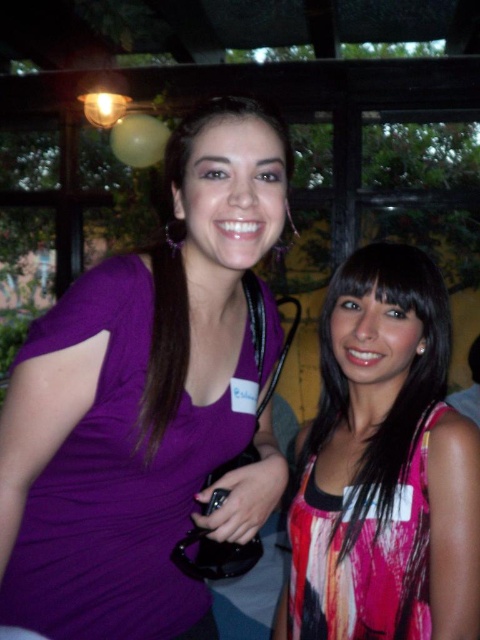
Question: Which point is closer to the camera?

Choices:
 (A) (4, 429)
 (B) (372, 320)

Answer: (A)

Question: Which object is closer to the camera taking this photo?

Choices:
 (A) matte purple shirt at center
 (B) multicolored fabric dress at right

Answer: (A)

Question: Can you confirm if purple matte shirt at center is positioned to the left of multicolored fabric dress at right?

Choices:
 (A) no
 (B) yes

Answer: (B)

Question: Where is multicolored fabric dress at right located in relation to matte purple shirt at center in the image?

Choices:
 (A) left
 (B) right

Answer: (B)

Question: From the image, what is the correct spatial relationship of multicolored fabric dress at right in relation to matte purple shirt at center?

Choices:
 (A) left
 (B) right

Answer: (B)

Question: Which object is farther from the camera taking this photo?

Choices:
 (A) multicolored fabric dress at right
 (B) purple matte shirt at center

Answer: (A)